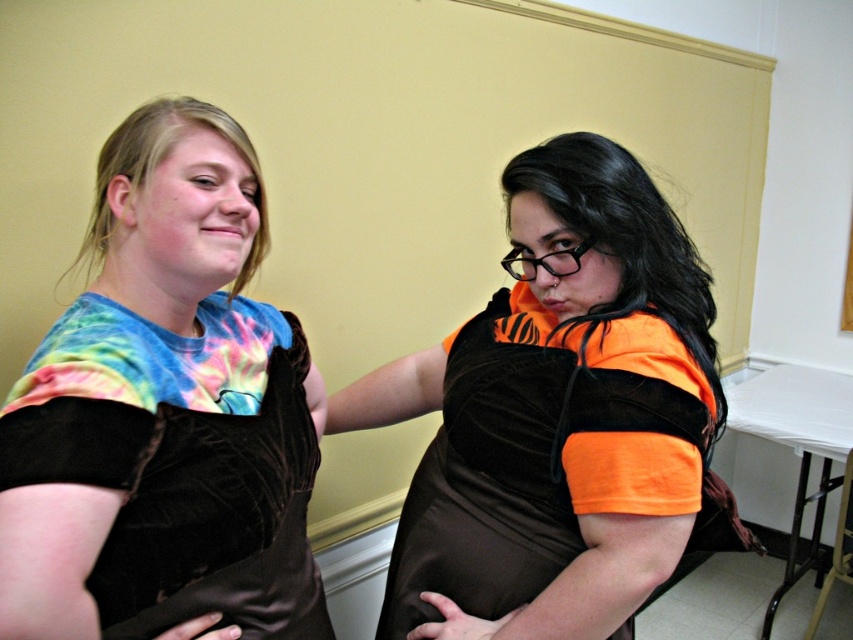
Describe the element at coordinates (165, 413) in the screenshot. I see `tie-dye fabric shirt at left` at that location.

Can you confirm if tie-dye fabric shirt at left is wider than velvet brown dress at center?

No.

Find the location of a particular element. The image size is (853, 640). tie-dye fabric shirt at left is located at coordinates (165, 413).